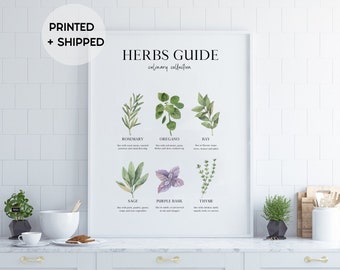
Find the location of a particular element. frame is located at coordinates (250, 126).